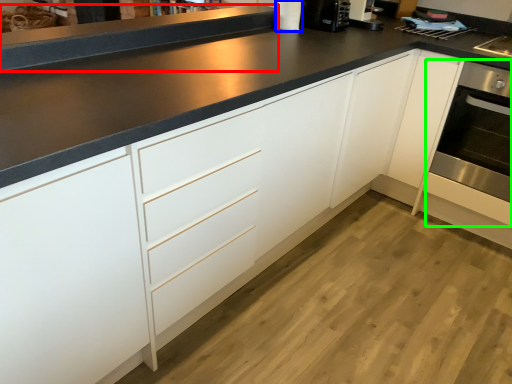
Question: Estimate the real-world distances between objects in this image. Which object is closer to counter top (highlighted by a red box), appliance (highlighted by a blue box) or oven (highlighted by a green box)?

Choices:
 (A) appliance
 (B) oven

Answer: (A)